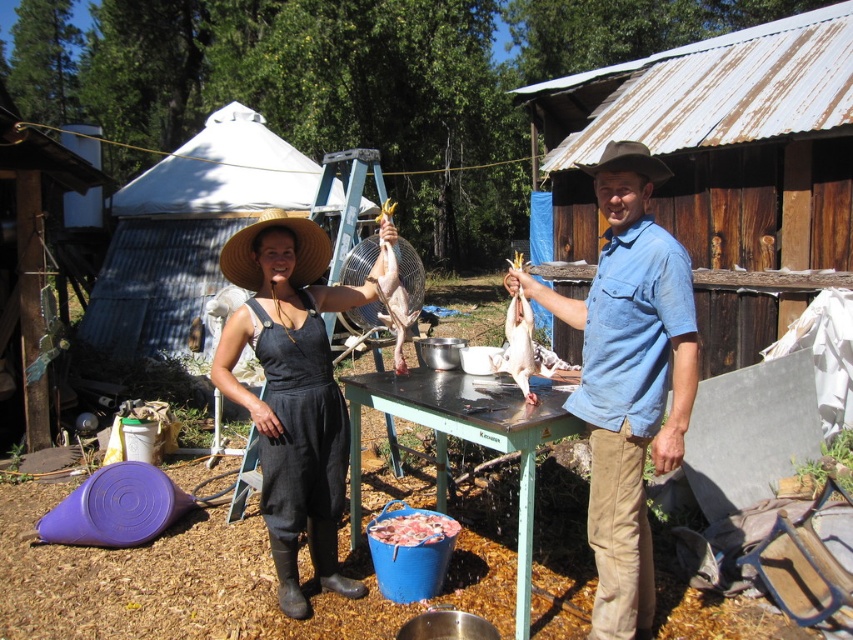
You are a photographer trying to capture a closeup shot of both the smooth skin duck at center and the brown felt cowboy hat at center. Since you want to focus on the details of both objects, which one should you zoom in more on to ensure clarity?

The smooth skin duck at center is larger in size compared to the brown felt cowboy hat at center, so you should zoom in more on the brown felt cowboy hat at center to ensure its details are clear.

You are a photographer trying to capture a closeup of the smooth skin duck at center and the brown felt cowboy hat at center. Your camera can focus on objects within a 3.5 feet range. Can you fit both objects in the same frame without moving the camera?

The smooth skin duck at center and brown felt cowboy hat at center are 3.97 feet apart, which is beyond the camera focus range of 3.5 feet. Therefore, you cannot fit both objects in the same frame without moving the camera.

You are an observer looking at the scene. You notice the black cotton dress at center and the straw hat at center. Which object is taller?

The black cotton dress at center is taller than the straw hat at center.